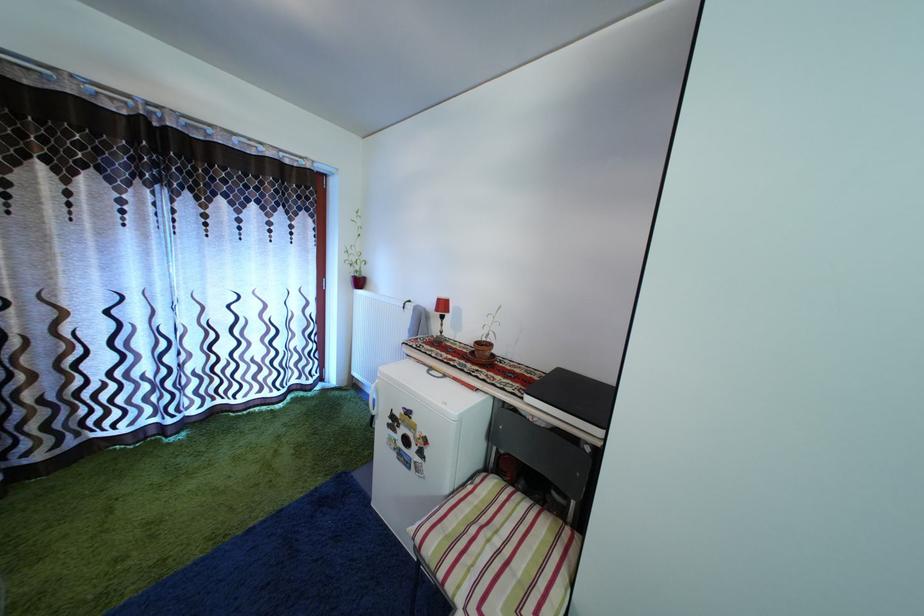
At what (x,y) coordinates should I click in order to perform the action: click on white fridge handle. Please return your answer as a coordinate pair (x, y). Image resolution: width=924 pixels, height=616 pixels. Looking at the image, I should click on (372, 403).